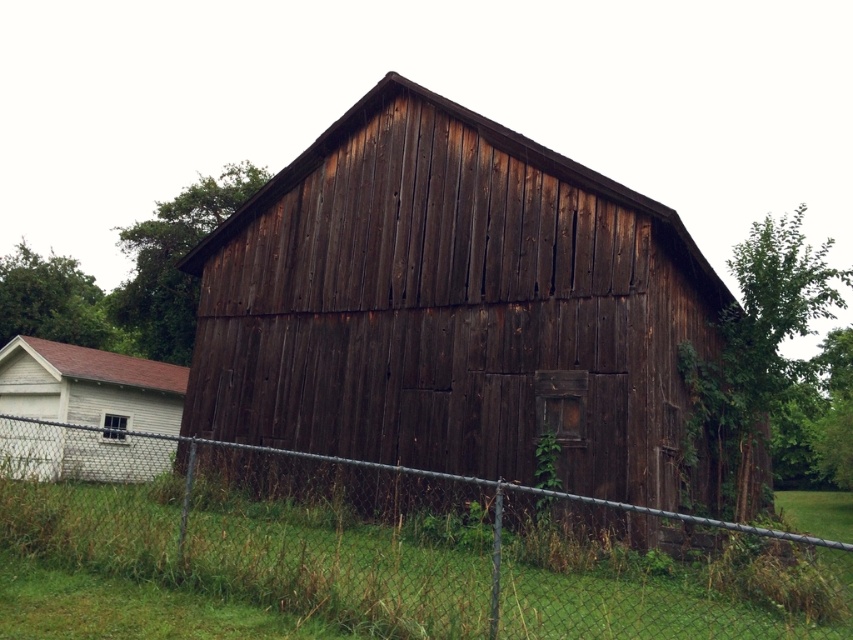
Question: Where is dark wood barn at center located in relation to green grass at lower center in the image?

Choices:
 (A) right
 (B) left

Answer: (A)

Question: Where is dark wood barn at center located in relation to green grass at lower center in the image?

Choices:
 (A) above
 (B) below

Answer: (A)

Question: Which point is closer to the camera taking this photo?

Choices:
 (A) (212, 492)
 (B) (512, 474)

Answer: (B)

Question: Considering the relative positions of dark wood barn at center and green grass at lower center in the image provided, where is dark wood barn at center located with respect to green grass at lower center?

Choices:
 (A) above
 (B) below

Answer: (A)